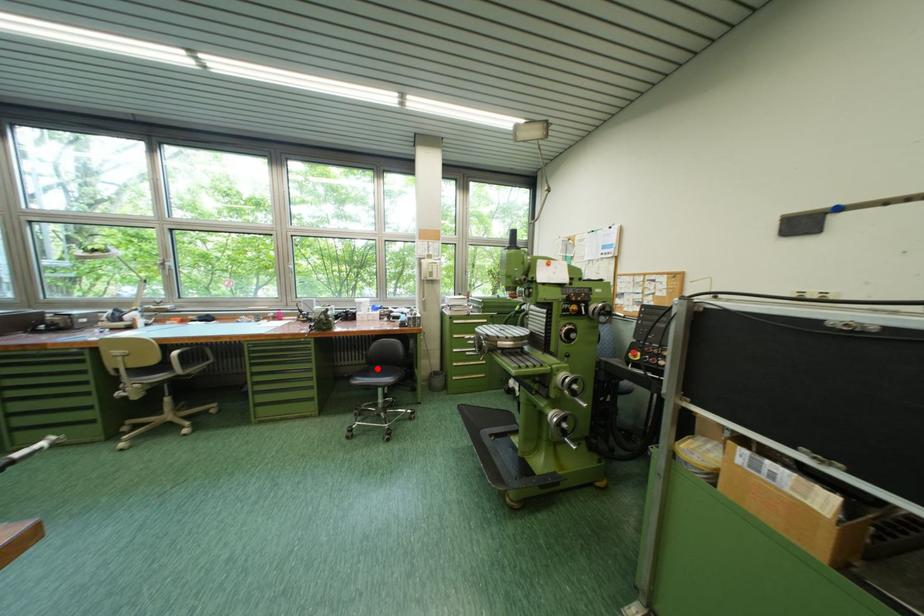
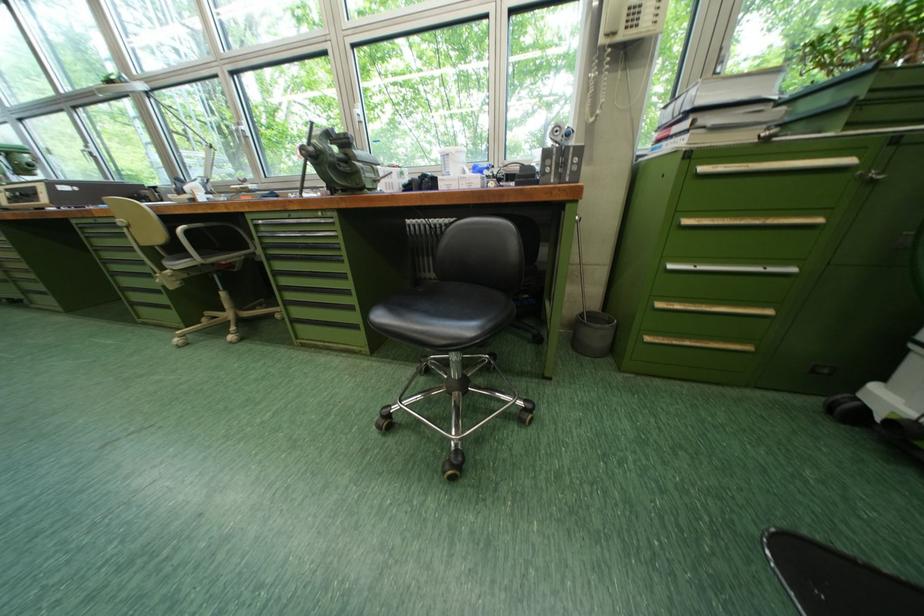
The point at the highlighted location is marked in the first image. Where is the corresponding point in the second image?

(448, 284)